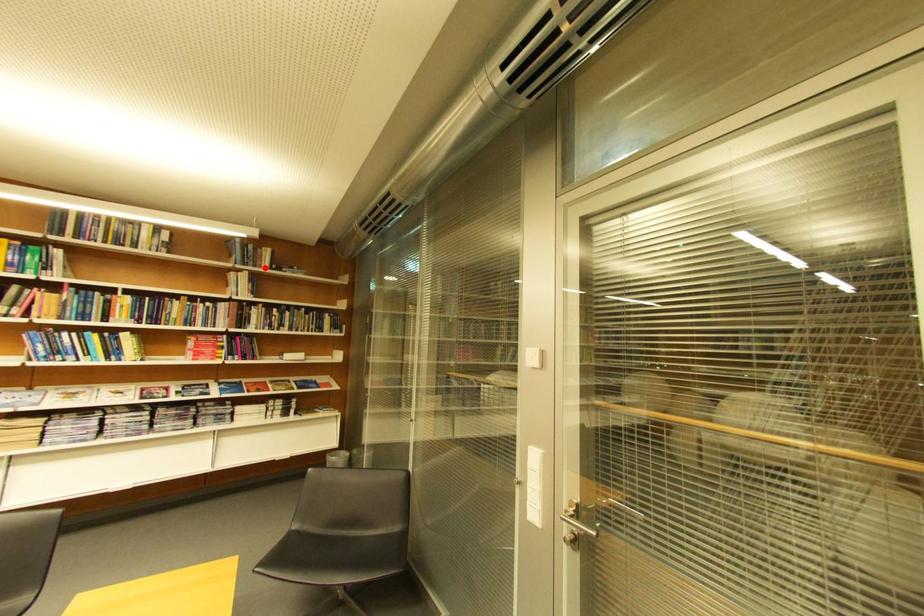
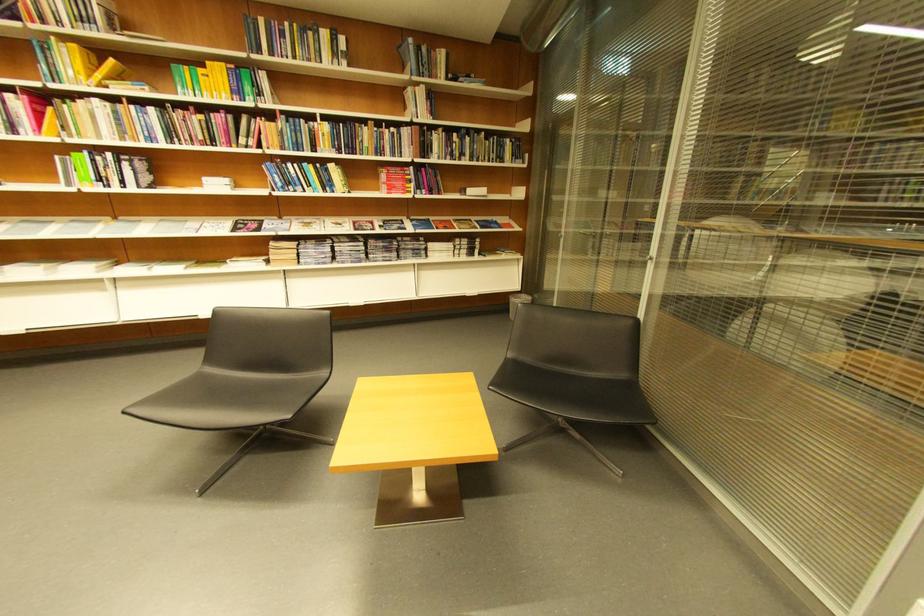
Where in the second image is the point corresponding to the highlighted location from the first image?

(441, 78)